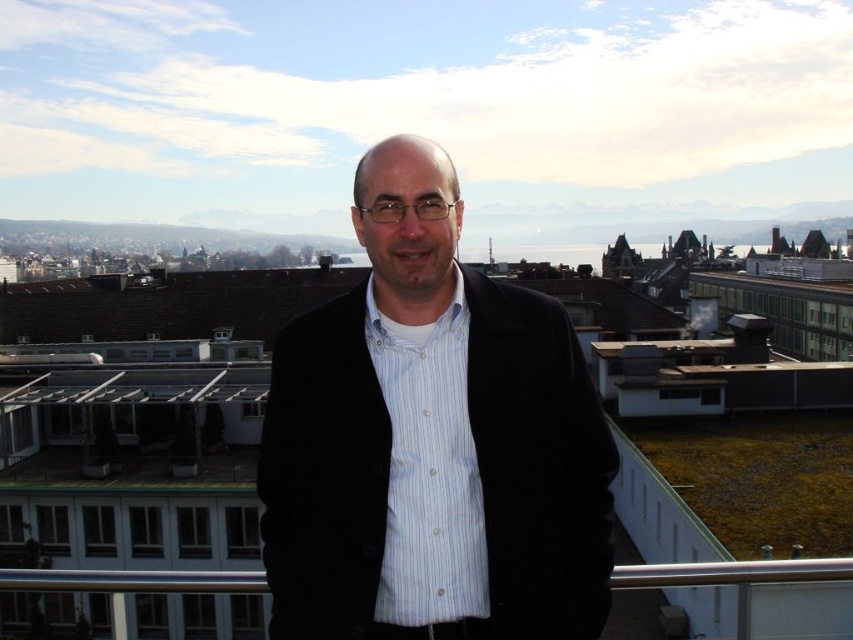
You are standing on the rooftop and want to move from the point closer to you to the farther point. Which direction should you move to get from point (303, 605) to point (837, 566)?

To move from point (303, 605) to point (837, 566), you should move towards the upper right direction since point (303, 605) is closer to the viewer and point (837, 566) is farther away.

You are a delivery person who needs to place a black matte jacket at center on the rooftop. The coordinates for the jacket are given as point 0.691, 0.508. If the rooftop is a rectangle, where would you place the jacket? Choose from the options below. 1. Near the center. 2. Near the edge. 3. Near the corner. 4. Near the railing.

The coordinates for the black matte jacket at center are at point (432, 442). Since both coordinates are close to 0.5, this indicates the jacket is near the center of the rooftop. So the correct answer is 1. Near the center.